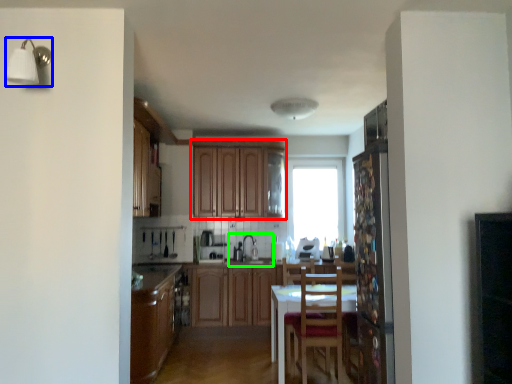
Question: Which object is positioned closest to cabinetry (highlighted by a red box)? Select from light fixture (highlighted by a blue box) and sink (highlighted by a green box).

Choices:
 (A) light fixture
 (B) sink

Answer: (B)